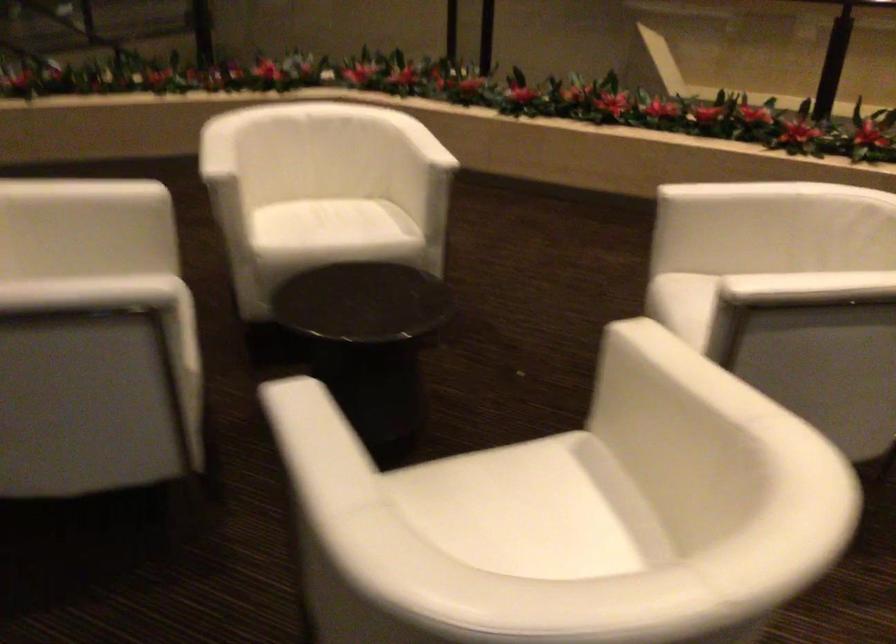
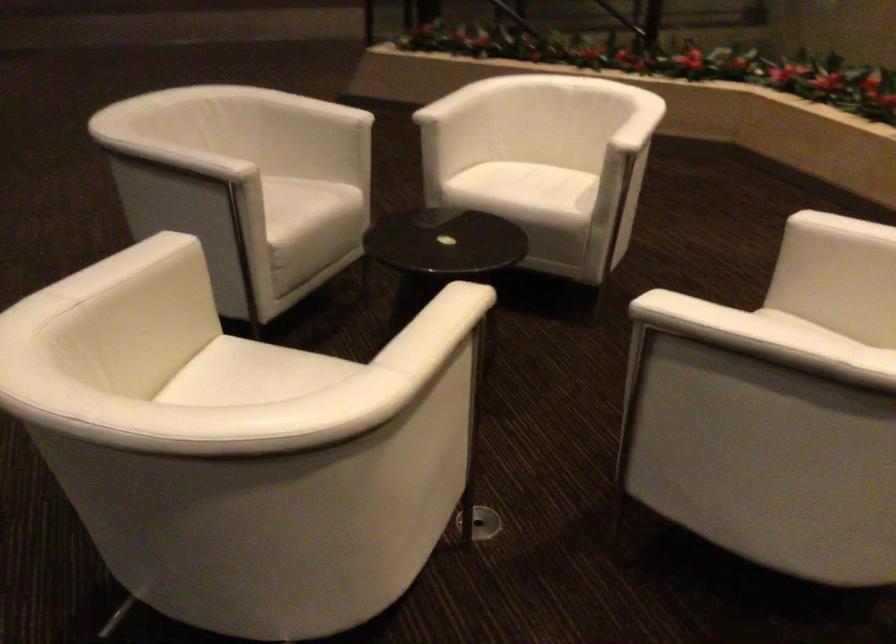
In the second image, find the point that corresponds to [231,138] in the first image.

(469, 89)